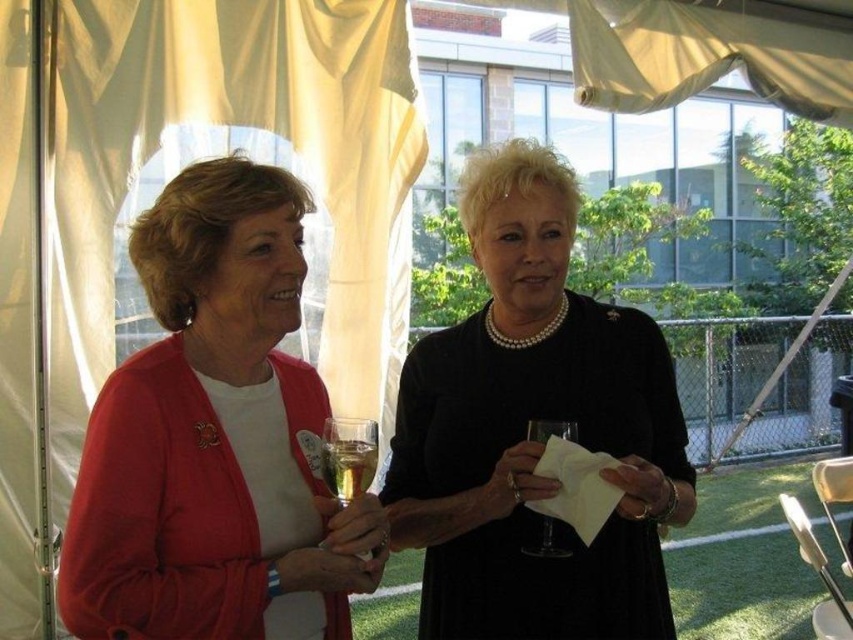
Question: Is translucent glass at center thinner than transparent glass at center?

Choices:
 (A) no
 (B) yes

Answer: (B)

Question: Does black pearl necklace at center appear under transparent glass at center?

Choices:
 (A) no
 (B) yes

Answer: (A)

Question: Which point is farther from the camera taking this photo?

Choices:
 (A) (769, 26)
 (B) (251, 547)
 (C) (358, 493)
 (D) (489, 540)

Answer: (A)

Question: Which object is the closest to the clear glass wine glass at center?

Choices:
 (A) black pearl necklace at center
 (B) matte red cardigan at center

Answer: (B)

Question: Is matte red cardigan at center above black pearl necklace at center?

Choices:
 (A) no
 (B) yes

Answer: (A)

Question: Which of the following is the farthest from the observer?

Choices:
 (A) (296, 403)
 (B) (635, 77)

Answer: (B)